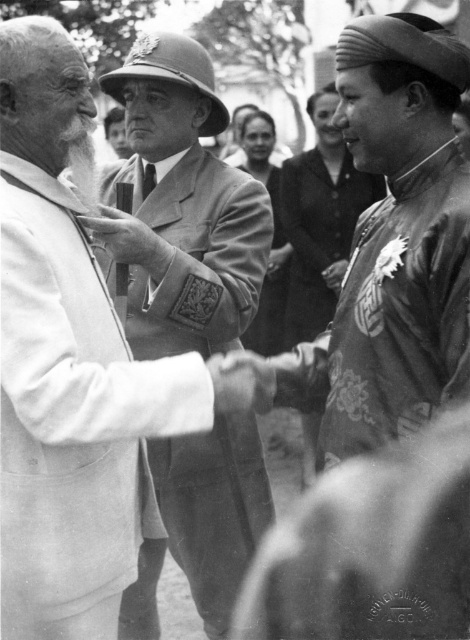
Is smooth fabric uniform at center to the left of black silk tie at center from the viewer's perspective?

In fact, smooth fabric uniform at center is to the right of black silk tie at center.

Between point (224, 493) and point (147, 189), which one is positioned behind?

Positioned behind is point (147, 189).

Which is behind, point (194, 84) or point (142, 182)?

The point (142, 182) is more distant.

Locate an element on the screen. The height and width of the screenshot is (640, 470). smooth fabric uniform at center is located at coordinates (187, 204).

Can you confirm if matte gold medallion at center is taller than black silk tie at center?

Yes, matte gold medallion at center is taller than black silk tie at center.

Is matte gold medallion at center to the left of black silk tie at center from the viewer's perspective?

Correct, you'll find matte gold medallion at center to the left of black silk tie at center.

Who is more distant from viewer, (x=167, y=259) or (x=142, y=182)?

The point (x=142, y=182) is more distant.

Image resolution: width=470 pixels, height=640 pixels. What are the coordinates of `matte gold medallion at center` in the screenshot? It's located at (128, 240).

Does smooth fabric uniform at center have a smaller size compared to matte gold medallion at center?

No, smooth fabric uniform at center is not smaller than matte gold medallion at center.

Looking at this image, is smooth fabric uniform at center bigger than matte gold medallion at center?

Yes, smooth fabric uniform at center is bigger than matte gold medallion at center.

Who is more distant from viewer, (x=170, y=122) or (x=153, y=253)?

Point (x=170, y=122)

This screenshot has width=470, height=640. I want to click on smooth fabric uniform at center, so click(187, 204).